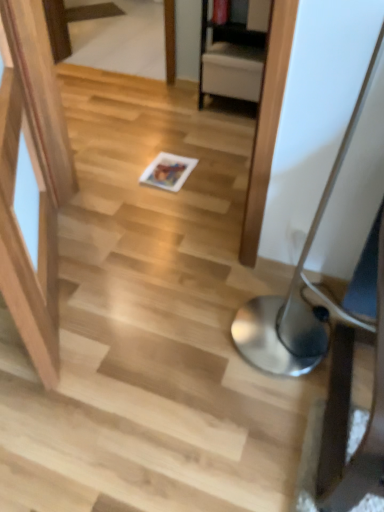
This screenshot has height=512, width=384. Describe the element at coordinates (168, 170) in the screenshot. I see `white glossy magazine at center` at that location.

At what (x,y) coordinates should I click in order to perform the action: click on white glossy magazine at center. Please return your answer as a coordinate pair (x, y). Looking at the image, I should click on (168, 170).

This screenshot has width=384, height=512. What do you see at coordinates (299, 288) in the screenshot?
I see `silver metallic table lamp at lower right` at bounding box center [299, 288].

The image size is (384, 512). In order to click on silver metallic table lamp at lower right in this screenshot , I will do `click(299, 288)`.

What is the approximate height of silver metallic table lamp at lower right?

silver metallic table lamp at lower right is 1.05 meters tall.

Where is `white glossy magazine at center`? white glossy magazine at center is located at coordinates (168, 170).

Is silver metallic table lamp at lower right at the right side of white glossy magazine at center?

Yes.

Is the position of silver metallic table lamp at lower right less distant than that of white glossy magazine at center?

Yes, silver metallic table lamp at lower right is closer to the camera.

Is point (282, 321) in front of point (185, 172)?

Yes, it is in front of point (185, 172).

From the image's perspective, which is above, silver metallic table lamp at lower right or white glossy magazine at center?

white glossy magazine at center is shown above in the image.

From a real-world perspective, is silver metallic table lamp at lower right positioned under white glossy magazine at center based on gravity?

No, from a real-world perspective, silver metallic table lamp at lower right is not under white glossy magazine at center.

In terms of width, does silver metallic table lamp at lower right look wider or thinner when compared to white glossy magazine at center?

In the image, silver metallic table lamp at lower right appears to be wider than white glossy magazine at center.

In the scene shown: Which of these two, silver metallic table lamp at lower right or white glossy magazine at center, stands taller?

With more height is silver metallic table lamp at lower right.

Looking at the image, does silver metallic table lamp at lower right seem bigger or smaller compared to white glossy magazine at center?

silver metallic table lamp at lower right is bigger than white glossy magazine at center.

Which is correct: silver metallic table lamp at lower right is inside white glossy magazine at center, or outside of it?

silver metallic table lamp at lower right is located beyond the bounds of white glossy magazine at center.

Is silver metallic table lamp at lower right next to white glossy magazine at center and touching it?

No, silver metallic table lamp at lower right is not next to white glossy magazine at center.

Is silver metallic table lamp at lower right facing away from white glossy magazine at center?

silver metallic table lamp at lower right is not turned away from white glossy magazine at center.

Image resolution: width=384 pixels, height=512 pixels. Find the location of `magazine lying above the silver metallic table lamp at lower right (from the image's perspective)`. magazine lying above the silver metallic table lamp at lower right (from the image's perspective) is located at coordinates (168, 170).

Is white glossy magazine at center to the left or to the right of silver metallic table lamp at lower right in the image?

In the image, white glossy magazine at center appears on the left side of silver metallic table lamp at lower right.

Between white glossy magazine at center and silver metallic table lamp at lower right, which one is positioned in front?

Positioned in front is silver metallic table lamp at lower right.

From the picture: Which is further, (166, 175) or (282, 375)?

Point (166, 175)

From the image's perspective, is white glossy magazine at center over silver metallic table lamp at lower right?

Correct, white glossy magazine at center appears higher than silver metallic table lamp at lower right in the image.

From a real-world perspective, who is located lower, white glossy magazine at center or silver metallic table lamp at lower right?

From a 3D spatial view, white glossy magazine at center is below.

Considering the relative sizes of white glossy magazine at center and silver metallic table lamp at lower right in the image provided, is white glossy magazine at center thinner than silver metallic table lamp at lower right?

Correct, the width of white glossy magazine at center is less than that of silver metallic table lamp at lower right.

Considering the sizes of objects white glossy magazine at center and silver metallic table lamp at lower right in the image provided, who is taller, white glossy magazine at center or silver metallic table lamp at lower right?

With more height is silver metallic table lamp at lower right.

Which of these two, white glossy magazine at center or silver metallic table lamp at lower right, is bigger?

Bigger between the two is silver metallic table lamp at lower right.

Is white glossy magazine at center surrounding silver metallic table lamp at lower right?

No, white glossy magazine at center does not contain silver metallic table lamp at lower right.

Can you see white glossy magazine at center touching silver metallic table lamp at lower right?

There is a gap between white glossy magazine at center and silver metallic table lamp at lower right.

Is white glossy magazine at center facing away from silver metallic table lamp at lower right?

white glossy magazine at center is not turned away from silver metallic table lamp at lower right.

Identify the location of magazine located underneath the silver metallic table lamp at lower right (from a real-world perspective). This screenshot has height=512, width=384. (168, 170).

The height and width of the screenshot is (512, 384). I want to click on magazine that appears above the silver metallic table lamp at lower right (from the image's perspective), so click(x=168, y=170).

Locate an element on the screen. table lamp in front of the white glossy magazine at center is located at coordinates (x=299, y=288).